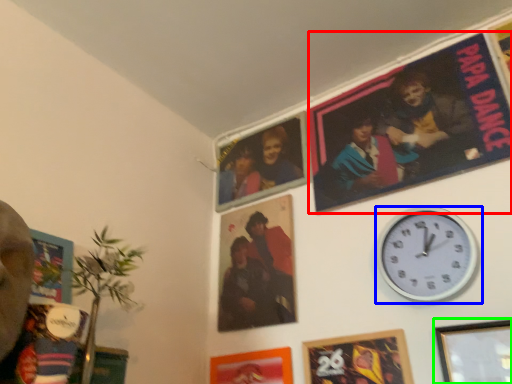
Question: Estimate the real-world distances between objects in this image. Which object is closer to movie poster (highlighted by a red box), wall clock (highlighted by a blue box) or picture frame (highlighted by a green box)?

Choices:
 (A) wall clock
 (B) picture frame

Answer: (A)